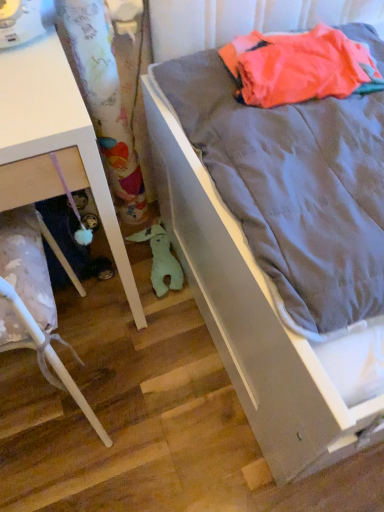
Identify the location of free point below green plush toy at lower center (from a real-world perspective). (154, 268).